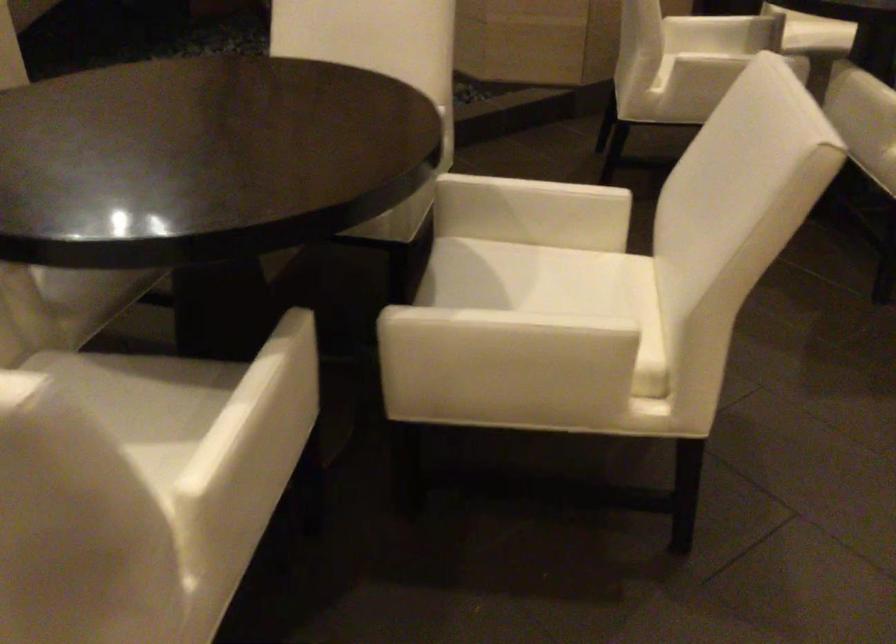
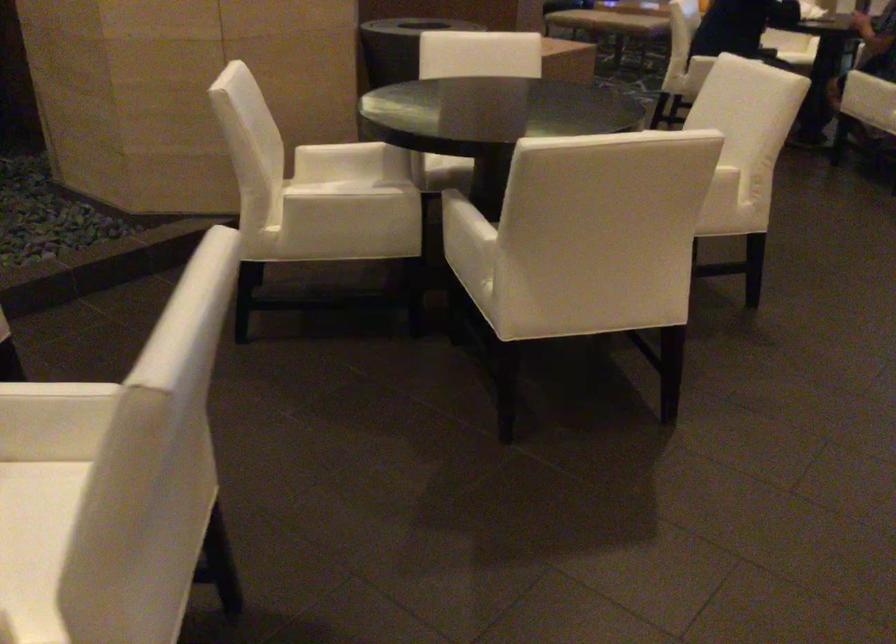
Question: The images are taken continuously from a first-person perspective. In which direction are you moving?

Choices:
 (A) Left
 (B) Right
 (C) Forward
 (D) Backward

Answer: (B)